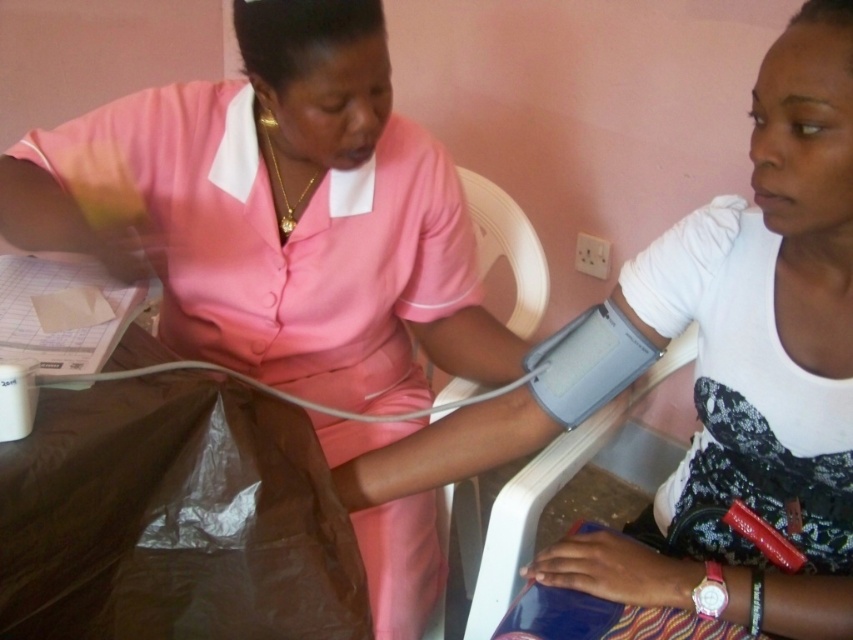
Question: Can you confirm if pink fabric nurse at center is positioned above matte pink uniform at center?

Choices:
 (A) no
 (B) yes

Answer: (B)

Question: Which object is closer to the camera taking this photo?

Choices:
 (A) matte pink uniform at center
 (B) pink fabric nurse at center

Answer: (A)

Question: Can you confirm if pink fabric nurse at center is positioned above matte pink uniform at center?

Choices:
 (A) yes
 (B) no

Answer: (A)

Question: From the image, what is the correct spatial relationship of pink fabric nurse at center in relation to matte pink uniform at center?

Choices:
 (A) right
 (B) left

Answer: (B)

Question: Which object appears farthest from the camera in this image?

Choices:
 (A) matte pink uniform at center
 (B) pink fabric nurse at center

Answer: (B)

Question: Which point is farther to the camera?

Choices:
 (A) (728, 230)
 (B) (322, 448)

Answer: (B)